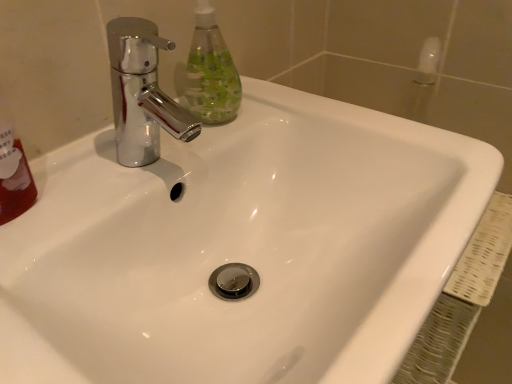
Find the location of a particular element. Image resolution: width=512 pixels, height=384 pixels. vacant area to the right of clear plastic bottle at upper left is located at coordinates (307, 119).